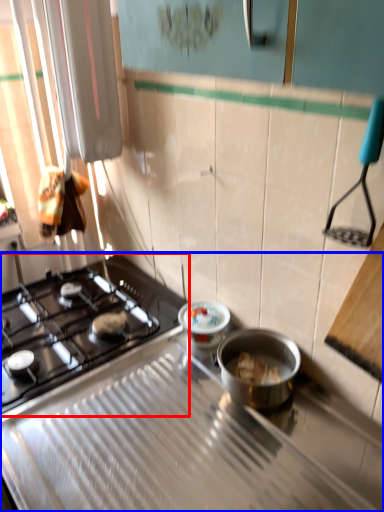
Question: Among these objects, which one is nearest to the camera, gas stove (highlighted by a red box) or gas stove (highlighted by a blue box)?

Choices:
 (A) gas stove
 (B) gas stove

Answer: (B)